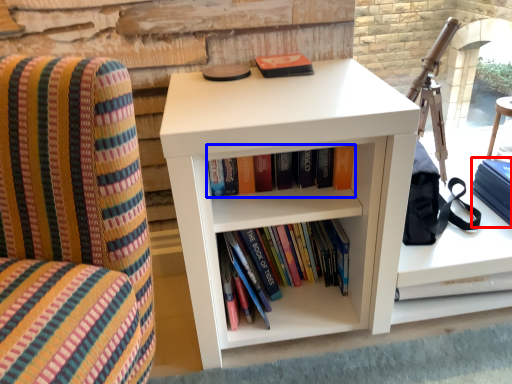
Question: Among these objects, which one is farthest to the camera, paperback book (highlighted by a red box) or book (highlighted by a blue box)?

Choices:
 (A) paperback book
 (B) book

Answer: (A)